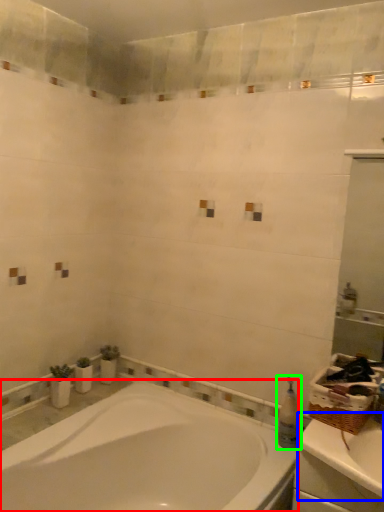
Question: Estimate the real-world distances between objects in this image. Which object is farther from bathtub (highlighted by a red box), counter top (highlighted by a blue box) or toiletry (highlighted by a green box)?

Choices:
 (A) counter top
 (B) toiletry

Answer: (B)